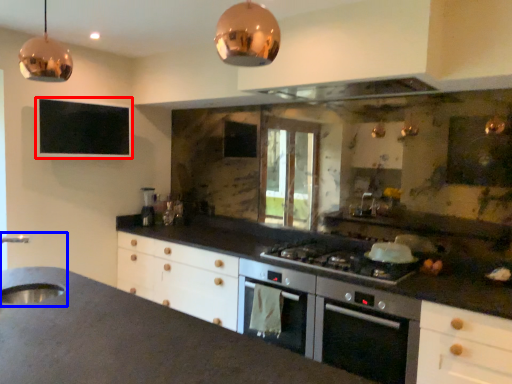
Question: Which object is further to the camera taking this photo, window screen (highlighted by a red box) or sink (highlighted by a blue box)?

Choices:
 (A) window screen
 (B) sink

Answer: (A)